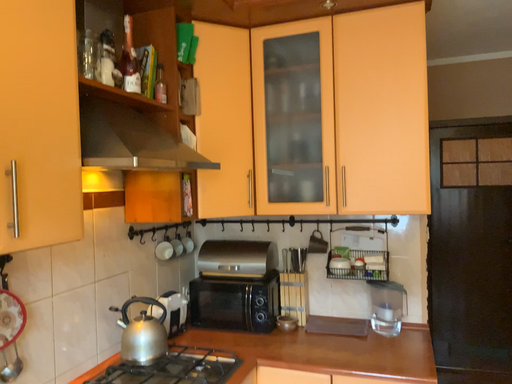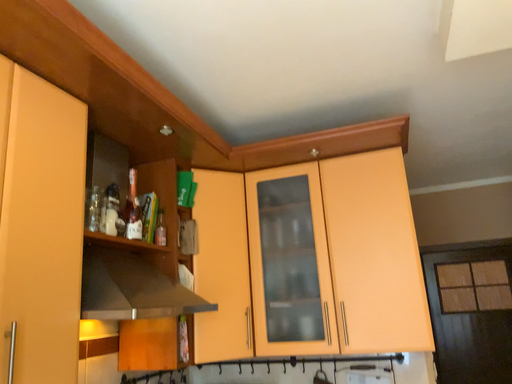
Question: How did the camera likely rotate when shooting the video?

Choices:
 (A) rotated upward
 (B) rotated downward

Answer: (A)